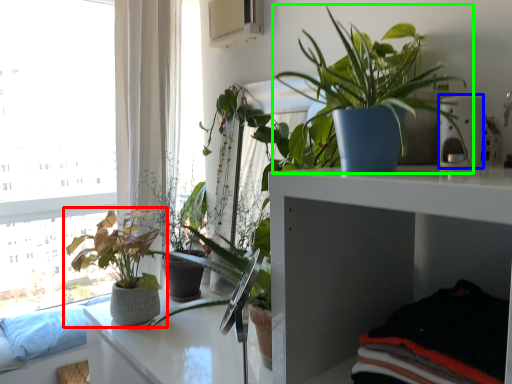
Question: Which object is the closest to the houseplant (highlighted by a red box)? Choose among these: appliance (highlighted by a blue box) or houseplant (highlighted by a green box).

Choices:
 (A) appliance
 (B) houseplant

Answer: (B)